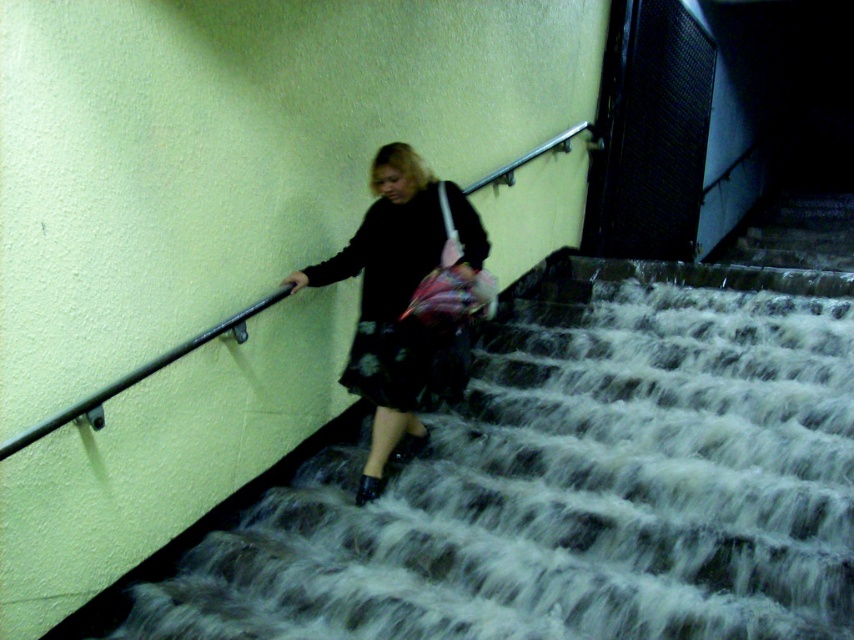
Which is more to the right, smooth concrete stairs at center or matte black dress at center?

From the viewer's perspective, smooth concrete stairs at center appears more on the right side.

Which is behind, point (463, 586) or point (361, 314)?

Positioned behind is point (361, 314).

Locate an element on the screen. The width and height of the screenshot is (854, 640). smooth concrete stairs at center is located at coordinates (560, 483).